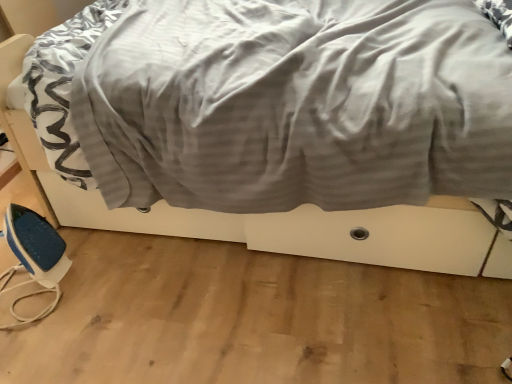
The height and width of the screenshot is (384, 512). What do you see at coordinates (34, 257) in the screenshot? I see `blue plastic iron at lower left` at bounding box center [34, 257].

Find the location of a particular element. Image resolution: width=512 pixels, height=384 pixels. blue plastic iron at lower left is located at coordinates (34, 257).

What do you see at coordinates (288, 105) in the screenshot? This screenshot has height=384, width=512. I see `white fabric bed at center` at bounding box center [288, 105].

The image size is (512, 384). Find the location of `white fabric bed at center`. white fabric bed at center is located at coordinates (288, 105).

You are a GUI agent. You are given a task and a screenshot of the screen. Output one action in this format:
    pyautogui.click(x=<x>, y=<y>)
    Task: Click on the blue plastic iron at lower left
    
    Given the screenshot: What is the action you would take?
    pyautogui.click(x=34, y=257)

Considering the relative positions of white fabric bed at center and blue plastic iron at lower left in the image provided, is white fabric bed at center to the right of blue plastic iron at lower left from the viewer's perspective?

Indeed, white fabric bed at center is positioned on the right side of blue plastic iron at lower left.

Is white fabric bed at center closer to the viewer compared to blue plastic iron at lower left?

Yes, it is.

Considering the positions of point (192, 64) and point (18, 258), is point (192, 64) closer or farther from the camera than point (18, 258)?

Point (192, 64) is closer to the camera than point (18, 258).

From the image's perspective, which one is positioned lower, white fabric bed at center or blue plastic iron at lower left?

blue plastic iron at lower left appears lower in the image.

From a real-world perspective, which object rests below the other?

blue plastic iron at lower left is physically lower.

Considering the relative sizes of white fabric bed at center and blue plastic iron at lower left in the image provided, is white fabric bed at center wider than blue plastic iron at lower left?

Indeed, white fabric bed at center has a greater width compared to blue plastic iron at lower left.

Considering the relative sizes of white fabric bed at center and blue plastic iron at lower left in the image provided, is white fabric bed at center taller than blue plastic iron at lower left?

Indeed, white fabric bed at center has a greater height compared to blue plastic iron at lower left.

Does white fabric bed at center have a larger size compared to blue plastic iron at lower left?

Indeed, white fabric bed at center has a larger size compared to blue plastic iron at lower left.

Based on the photo, is blue plastic iron at lower left inside white fabric bed at center?

No.

Is white fabric bed at center not near blue plastic iron at lower left?

No.

Is white fabric bed at center turned away from blue plastic iron at lower left?

No, white fabric bed at center's orientation is not away from blue plastic iron at lower left.

At what (x,y) coordinates should I click in order to perform the action: click on equipment behind the white fabric bed at center. Please return your answer as a coordinate pair (x, y). Looking at the image, I should click on (34, 257).

Looking at this image, which object is positioned more to the right, blue plastic iron at lower left or white fabric bed at center?

white fabric bed at center is more to the right.

Is blue plastic iron at lower left positioned before white fabric bed at center?

No.

Considering the points (23, 297) and (143, 125), which point is in front, point (23, 297) or point (143, 125)?

The point (143, 125) is closer.

From the image's perspective, is blue plastic iron at lower left located above white fabric bed at center?

No.

From a real-world perspective, which is physically above, blue plastic iron at lower left or white fabric bed at center?

white fabric bed at center, from a real-world perspective.

Looking at their sizes, would you say blue plastic iron at lower left is wider or thinner than white fabric bed at center?

blue plastic iron at lower left is thinner than white fabric bed at center.

From their relative heights in the image, would you say blue plastic iron at lower left is taller or shorter than white fabric bed at center?

Considering their sizes, blue plastic iron at lower left has less height than white fabric bed at center.

Who is smaller, blue plastic iron at lower left or white fabric bed at center?

With smaller size is blue plastic iron at lower left.

Can we say blue plastic iron at lower left lies outside white fabric bed at center?

Yes.

Is blue plastic iron at lower left far away from white fabric bed at center?

No, blue plastic iron at lower left is in close proximity to white fabric bed at center.

Is white fabric bed at center at the back of blue plastic iron at lower left?

blue plastic iron at lower left does not have its back to white fabric bed at center.

How different are the orientations of blue plastic iron at lower left and white fabric bed at center in degrees?

The angle between the facing direction of blue plastic iron at lower left and the facing direction of white fabric bed at center is 4.08 degrees.

You are a GUI agent. You are given a task and a screenshot of the screen. Output one action in this format:
    pyautogui.click(x=<x>, y=<y>)
    Task: Click on the bed that is in front of the blue plastic iron at lower left
    This screenshot has width=512, height=384.
    Given the screenshot: What is the action you would take?
    (x=288, y=105)

This screenshot has width=512, height=384. In order to click on bed on the right of blue plastic iron at lower left in this screenshot , I will do `click(288, 105)`.

At what (x,y) coordinates should I click in order to perform the action: click on equipment beneath the white fabric bed at center (from a real-world perspective). Please return your answer as a coordinate pair (x, y). The image size is (512, 384). Looking at the image, I should click on (34, 257).